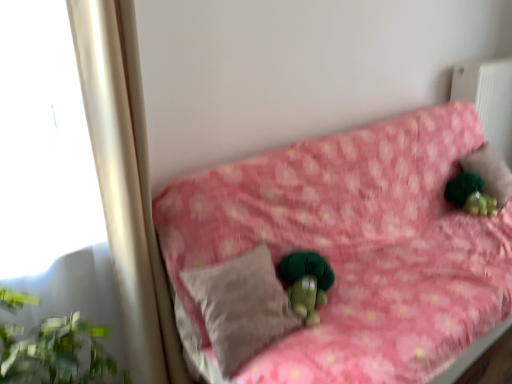
What is the approximate width of pink floral fabric couch at center?

pink floral fabric couch at center is 33.10 inches in width.

What do you see at coordinates (488, 99) in the screenshot?
I see `white textured radiator at upper right` at bounding box center [488, 99].

Find the location of a particular element. The height and width of the screenshot is (384, 512). beige soft pillow at center, acting as the 2th pillow starting from the top is located at coordinates (241, 306).

Describe the element at coordinates (241, 306) in the screenshot. The height and width of the screenshot is (384, 512). I see `beige soft pillow at center, the 1th pillow ordered from the bottom` at that location.

This screenshot has height=384, width=512. What are the coordinates of `beige fabric pillow at upper right, the second pillow positioned from the bottom` in the screenshot? It's located at (490, 172).

Considering the relative positions of beige fabric pillow at upper right, the second pillow positioned from the bottom, and white textured radiator at upper right in the image provided, is beige fabric pillow at upper right, the second pillow positioned from the bottom, to the left of white textured radiator at upper right from the viewer's perspective?

Indeed, beige fabric pillow at upper right, the second pillow positioned from the bottom, is positioned on the left side of white textured radiator at upper right.

Can you confirm if beige fabric pillow at upper right, the second pillow positioned from the bottom, is bigger than white textured radiator at upper right?

No, beige fabric pillow at upper right, the second pillow positioned from the bottom, is not bigger than white textured radiator at upper right.

Can you confirm if beige fabric pillow at upper right, positioned as the first pillow in top-to-bottom order, is taller than white textured radiator at upper right?

In fact, beige fabric pillow at upper right, positioned as the first pillow in top-to-bottom order, may be shorter than white textured radiator at upper right.

Based on the photo, is beige fabric pillow at upper right, which is the second pillow from front to back, completely or partially outside of white textured radiator at upper right?

Yes, beige fabric pillow at upper right, which is the second pillow from front to back, is located beyond the bounds of white textured radiator at upper right.

Is beige soft pillow at center, marked as the 1th pillow in a front-to-back arrangement, inside the boundaries of beige fabric pillow at upper right, the second pillow viewed from the left, or outside?

beige soft pillow at center, marked as the 1th pillow in a front-to-back arrangement, is not inside beige fabric pillow at upper right, the second pillow viewed from the left, it's outside.

Consider the image. Which of these two, beige soft pillow at center, the 1th pillow ordered from the bottom, or beige fabric pillow at upper right, the second pillow viewed from the left, is thinner?

With smaller width is beige fabric pillow at upper right, the second pillow viewed from the left.

From a real-world perspective, is beige soft pillow at center, marked as the first pillow in a left-to-right arrangement, positioned over beige fabric pillow at upper right, positioned as the 1th pillow in back-to-front order, based on gravity?

Actually, beige soft pillow at center, marked as the first pillow in a left-to-right arrangement, is physically below beige fabric pillow at upper right, positioned as the 1th pillow in back-to-front order, in the real world.

Is beige soft pillow at center, positioned as the 2th pillow in right-to-left order, with beige fabric pillow at upper right, which is the 1th pillow in right-to-left order?

No, beige soft pillow at center, positioned as the 2th pillow in right-to-left order, is not in contact with beige fabric pillow at upper right, which is the 1th pillow in right-to-left order.

From a real-world perspective, which is physically above, green fuzzy figurine at upper right or beige fabric pillow at upper right, the second pillow positioned from the bottom?

beige fabric pillow at upper right, the second pillow positioned from the bottom, from a real-world perspective.

Is green fuzzy figurine at upper right to the left or to the right of beige fabric pillow at upper right, which is the second pillow from front to back, in the image?

green fuzzy figurine at upper right is positioned on beige fabric pillow at upper right, which is the second pillow from front to back,'s left side.

Which is closer to the camera, (457, 200) or (483, 180)?

Point (457, 200)

Which is behind, green fuzzy figurine at upper right or beige fabric pillow at upper right, which is the second pillow from front to back?

beige fabric pillow at upper right, which is the second pillow from front to back, is more distant.

From the image's perspective, does beige soft pillow at center, acting as the second pillow starting from the back, appear higher than white textured radiator at upper right?

Actually, beige soft pillow at center, acting as the second pillow starting from the back, appears below white textured radiator at upper right in the image.

Is beige soft pillow at center, marked as the 1th pillow in a front-to-back arrangement, inside or outside of white textured radiator at upper right?

beige soft pillow at center, marked as the 1th pillow in a front-to-back arrangement, is spatially situated outside white textured radiator at upper right.

Is point (258, 247) closer or farther from the camera than point (488, 137)?

Point (258, 247) appears to be closer to the viewer than point (488, 137).

Is beige soft pillow at center, acting as the second pillow starting from the back, directly adjacent to white textured radiator at upper right?

beige soft pillow at center, acting as the second pillow starting from the back, is not next to white textured radiator at upper right, and they're not touching.

Which of these two, pink floral fabric couch at center or beige soft pillow at center, marked as the first pillow in a left-to-right arrangement, is bigger?

Bigger between the two is pink floral fabric couch at center.

From the image's perspective, who appears lower, pink floral fabric couch at center or beige soft pillow at center, marked as the first pillow in a left-to-right arrangement?

beige soft pillow at center, marked as the first pillow in a left-to-right arrangement, appears lower in the image.

Is pink floral fabric couch at center spatially inside beige soft pillow at center, the 1th pillow ordered from the bottom, or outside of it?

pink floral fabric couch at center lies outside beige soft pillow at center, the 1th pillow ordered from the bottom.

Which object is wider, pink floral fabric couch at center or beige soft pillow at center, positioned as the 2th pillow in right-to-left order?

pink floral fabric couch at center.

From the image's perspective, which is above, green fuzzy figurine at upper right or white textured radiator at upper right?

From the image's view, white textured radiator at upper right is above.

Considering the relative sizes of green fuzzy figurine at upper right and white textured radiator at upper right in the image provided, is green fuzzy figurine at upper right thinner than white textured radiator at upper right?

Indeed, green fuzzy figurine at upper right has a lesser width compared to white textured radiator at upper right.

Considering their positions, is beige soft pillow at center, positioned as the 2th pillow in right-to-left order, located in front of or behind green fuzzy figurine at upper right?

beige soft pillow at center, positioned as the 2th pillow in right-to-left order, is in front of green fuzzy figurine at upper right.

Does beige soft pillow at center, positioned as the 2th pillow in right-to-left order, appear on the right side of green fuzzy figurine at upper right?

No, beige soft pillow at center, positioned as the 2th pillow in right-to-left order, is not to the right of green fuzzy figurine at upper right.

Measure the distance between beige soft pillow at center, marked as the 1th pillow in a front-to-back arrangement, and green fuzzy figurine at upper right.

The distance of beige soft pillow at center, marked as the 1th pillow in a front-to-back arrangement, from green fuzzy figurine at upper right is 1.36 meters.

Consider the image. Is beige soft pillow at center, marked as the first pillow in a left-to-right arrangement, next to green fuzzy figurine at upper right?

No, beige soft pillow at center, marked as the first pillow in a left-to-right arrangement, is not next to green fuzzy figurine at upper right.

This screenshot has width=512, height=384. In order to click on radiator above the beige fabric pillow at upper right, positioned as the 1th pillow in back-to-front order (from the image's perspective) in this screenshot , I will do `click(488, 99)`.

The width and height of the screenshot is (512, 384). In the image, there is a beige fabric pillow at upper right, the second pillow positioned from the bottom. Identify the location of pillow below it (from a real-world perspective). (241, 306).

Based on their spatial positions, is pink floral fabric couch at center or green fuzzy figurine at upper right closer to beige fabric pillow at upper right, the second pillow viewed from the left?

Among the two, green fuzzy figurine at upper right is located nearer to beige fabric pillow at upper right, the second pillow viewed from the left.

Estimate the real-world distances between objects in this image. Which object is further from beige fabric pillow at upper right, positioned as the 1th pillow in back-to-front order, pink floral fabric couch at center or white textured radiator at upper right?

Based on the image, pink floral fabric couch at center appears to be further to beige fabric pillow at upper right, positioned as the 1th pillow in back-to-front order.

Based on their spatial positions, is green fuzzy figurine at upper right or beige soft pillow at center, marked as the 1th pillow in a front-to-back arrangement, further from beige fabric pillow at upper right, the second pillow positioned from the bottom?

beige soft pillow at center, marked as the 1th pillow in a front-to-back arrangement.

Based on their spatial positions, is pink floral fabric couch at center or beige soft pillow at center, marked as the first pillow in a left-to-right arrangement, further from beige fabric pillow at upper right, which is the 1th pillow in right-to-left order?

beige soft pillow at center, marked as the first pillow in a left-to-right arrangement.

Consider the image. From the image, which object appears to be farther from white textured radiator at upper right, green fuzzy figurine at upper right or pink floral fabric couch at center?

Based on the image, pink floral fabric couch at center appears to be further to white textured radiator at upper right.

When comparing their distances from beige fabric pillow at upper right, positioned as the first pillow in top-to-bottom order, does white textured radiator at upper right or pink floral fabric couch at center seem further?

pink floral fabric couch at center is further to beige fabric pillow at upper right, positioned as the first pillow in top-to-bottom order.

Considering their positions, is beige soft pillow at center, the 1th pillow ordered from the bottom, positioned closer to green fuzzy figurine at upper right than pink floral fabric couch at center?

pink floral fabric couch at center is closer to green fuzzy figurine at upper right.

Based on their spatial positions, is green fuzzy figurine at upper right or beige fabric pillow at upper right, which is the second pillow from front to back, further from white textured radiator at upper right?

green fuzzy figurine at upper right is positioned further to the anchor white textured radiator at upper right.

This screenshot has width=512, height=384. Identify the location of pillow between beige soft pillow at center, acting as the 2th pillow starting from the top, and white textured radiator at upper right. (490, 172).

What are the coordinates of `figurine between beige soft pillow at center, marked as the 1th pillow in a front-to-back arrangement, and white textured radiator at upper right` in the screenshot? It's located at (470, 194).

Find the location of a particular element. The height and width of the screenshot is (384, 512). figurine between beige soft pillow at center, positioned as the 2th pillow in right-to-left order, and beige fabric pillow at upper right, which is the 1th pillow in right-to-left order is located at coordinates (470, 194).

At what (x,y) coordinates should I click in order to perform the action: click on figurine between pink floral fabric couch at center and white textured radiator at upper right from front to back. Please return your answer as a coordinate pair (x, y). The width and height of the screenshot is (512, 384). Looking at the image, I should click on (470, 194).